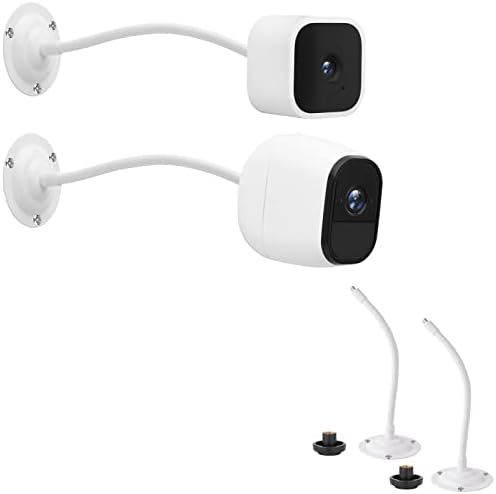
This screenshot has height=494, width=496. I want to click on wall mounts, so click(x=27, y=205), click(x=39, y=57).